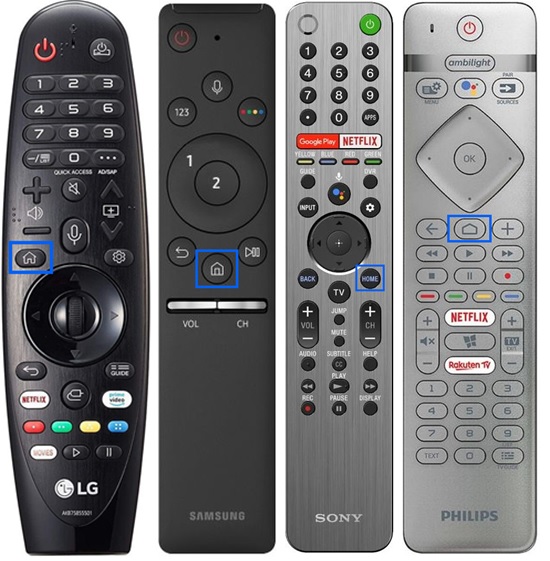
I want to click on remotes, so click(x=63, y=277), click(x=209, y=289), click(x=332, y=269), click(x=477, y=251).